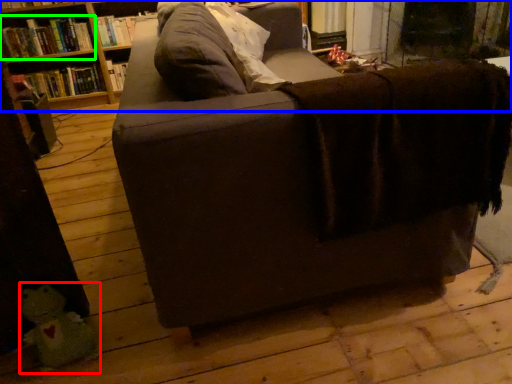
Question: Considering the real-world distances, which object is closest to toy (highlighted by a red box)? shelf (highlighted by a blue box) or book (highlighted by a green box).

Choices:
 (A) shelf
 (B) book

Answer: (B)